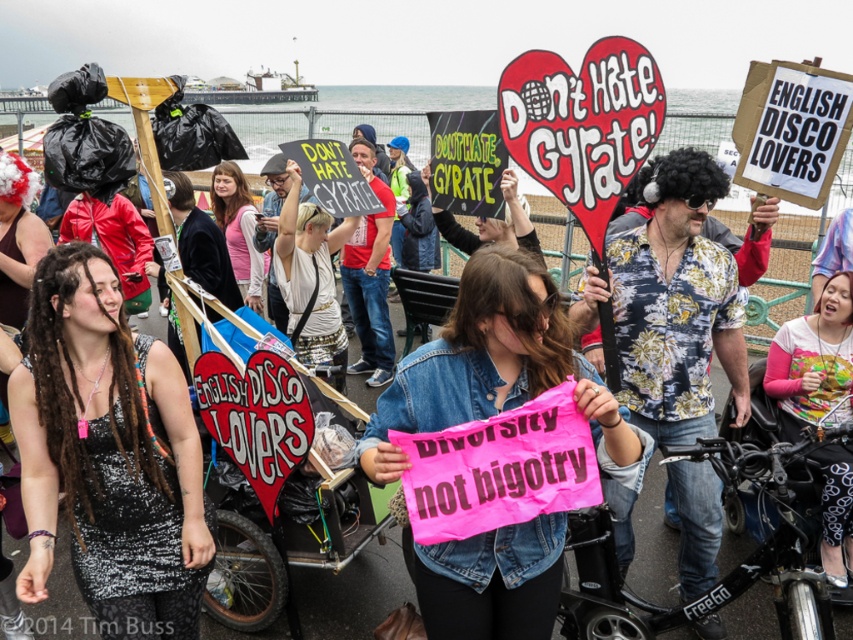
From the picture: Which is above, pink fabric shirt at lower right or pink fabric shirt at center?

pink fabric shirt at center is above.

Does pink fabric shirt at lower right appear on the right side of pink fabric shirt at center?

Yes, pink fabric shirt at lower right is to the right of pink fabric shirt at center.

Between point (830, 582) and point (244, 269), which one is positioned behind?

Point (244, 269)

At what (x,y) coordinates should I click in order to perform the action: click on pink fabric shirt at lower right. Please return your answer as a coordinate pair (x, y). This screenshot has width=853, height=640. Looking at the image, I should click on (813, 360).

Does pink fabric sign at center come in front of pink fabric shirt at lower right?

Yes, it is.

Who is positioned more to the right, pink fabric sign at center or pink fabric shirt at lower right?

Positioned to the right is pink fabric shirt at lower right.

The height and width of the screenshot is (640, 853). Identify the location of pink fabric sign at center. (495, 365).

Who is more distant from viewer, (184, 540) or (251, 252)?

Positioned behind is point (251, 252).

Based on the photo, can you confirm if black sequined dress at center is bigger than pink fabric shirt at center?

Yes.

Is point (158, 492) in front of point (230, 170)?

Yes, point (158, 492) is in front of point (230, 170).

Where is `black sequined dress at center`? The height and width of the screenshot is (640, 853). black sequined dress at center is located at coordinates (108, 456).